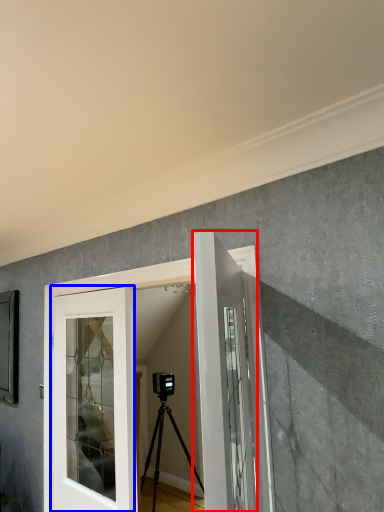
Question: Which object is closer to the camera taking this photo, door (highlighted by a red box) or door (highlighted by a blue box)?

Choices:
 (A) door
 (B) door

Answer: (A)